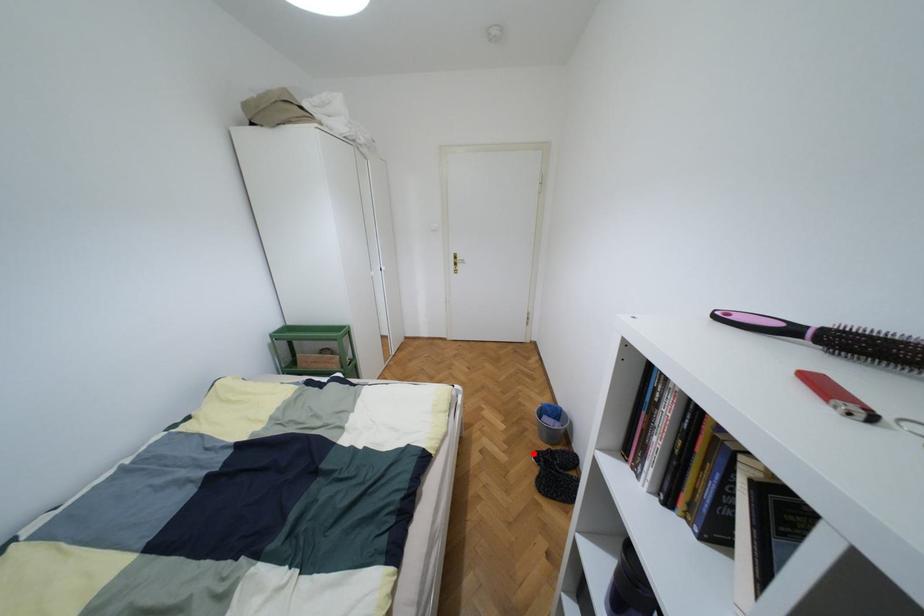
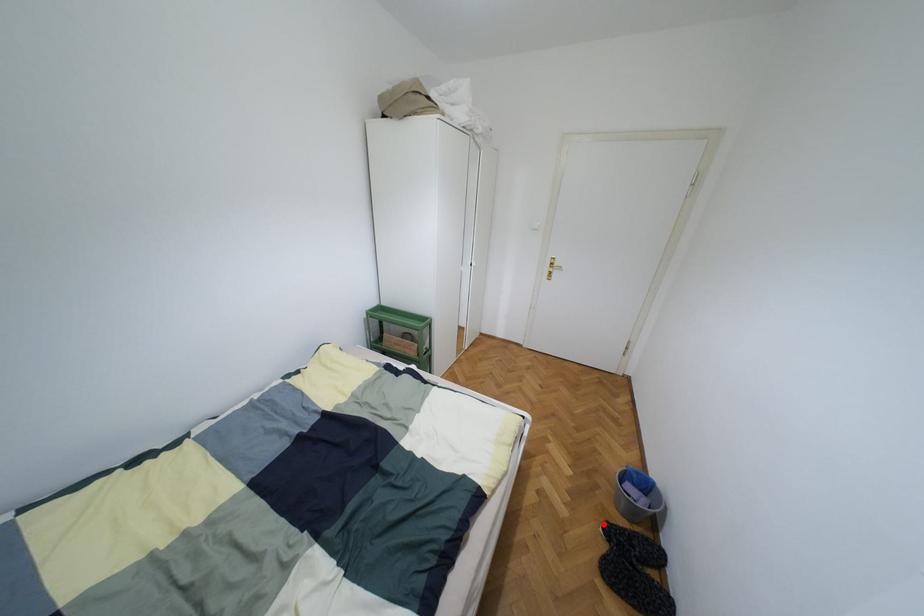
I am providing you with two images of the same scene from different viewpoints. A red point is marked on the first image and another point is marked on the second image. Are the points marked in image1 and image2 representing the same 3D position?

Yes